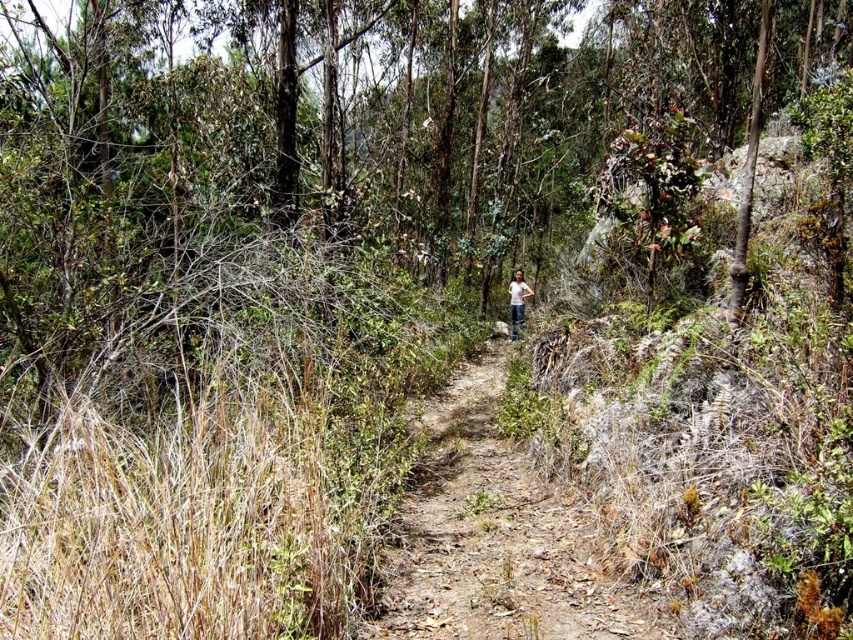
Question: Is dried grass at center in front of white cotton shirt at center?

Choices:
 (A) yes
 (B) no

Answer: (A)

Question: Is dried grass at center closer to camera compared to white cotton shirt at center?

Choices:
 (A) no
 (B) yes

Answer: (B)

Question: Which object appears closest to the camera in this image?

Choices:
 (A) dried grass at center
 (B) white cotton shirt at center

Answer: (A)

Question: Which point is closer to the camera taking this photo?

Choices:
 (A) (399, 547)
 (B) (518, 292)

Answer: (A)

Question: Does dried grass at center have a lesser width compared to white cotton shirt at center?

Choices:
 (A) no
 (B) yes

Answer: (A)